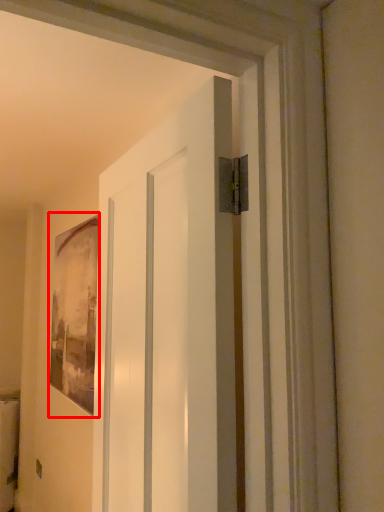
Question: From the image's perspective, what is the correct spatial positioning of picture frame (annotated by the red box) in reference to door?

Choices:
 (A) above
 (B) below

Answer: (B)